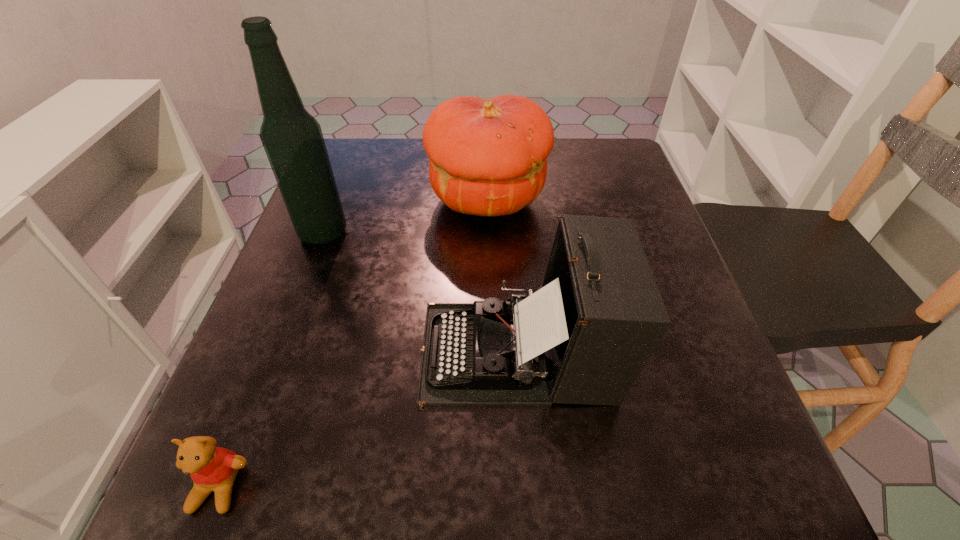
I want to click on object present at the far edge, so click(488, 157).

At what (x,y) coordinates should I click in order to perform the action: click on object that is at the near edge. Please return your answer as a coordinate pair (x, y). Looking at the image, I should click on (211, 468).

At what (x,y) coordinates should I click in order to perform the action: click on alcohol at the left edge. Please return your answer as a coordinate pair (x, y). The image size is (960, 540). Looking at the image, I should click on (292, 138).

You are a GUI agent. You are given a task and a screenshot of the screen. Output one action in this format:
    pyautogui.click(x=<x>, y=<y>)
    Task: Click on the teddy bear that is at the left edge
    The width and height of the screenshot is (960, 540).
    Given the screenshot: What is the action you would take?
    pyautogui.click(x=211, y=468)

Identify the location of object at the right edge. (583, 338).

The image size is (960, 540). Identify the location of object present at the near left corner. (211, 468).

Locate an element on the screen. This screenshot has height=540, width=960. blank space at the far edge of the desktop is located at coordinates (392, 174).

This screenshot has width=960, height=540. I want to click on vacant space at the near edge of the desktop, so click(x=523, y=517).

In order to click on vacant area at the left edge of the desktop in this screenshot , I will do `click(369, 203)`.

Locate an element on the screen. This screenshot has height=540, width=960. vacant area at the right edge is located at coordinates (662, 387).